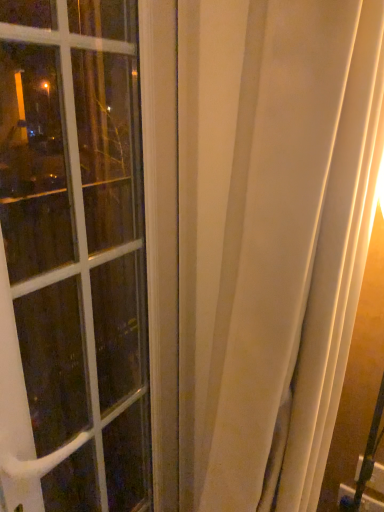
Question: Is white sheer curtain at center positioned behind white glass window at left?

Choices:
 (A) no
 (B) yes

Answer: (A)

Question: Can you confirm if white sheer curtain at center is shorter than white glass window at left?

Choices:
 (A) no
 (B) yes

Answer: (A)

Question: Are white sheer curtain at center and white glass window at left located far from each other?

Choices:
 (A) no
 (B) yes

Answer: (A)

Question: Is white sheer curtain at center beside white glass window at left?

Choices:
 (A) yes
 (B) no

Answer: (B)

Question: From a real-world perspective, is white sheer curtain at center physically above white glass window at left?

Choices:
 (A) yes
 (B) no

Answer: (B)

Question: Is white sheer curtain at center surrounding white glass window at left?

Choices:
 (A) yes
 (B) no

Answer: (B)

Question: Is white glass window at left positioned behind white sheer curtain at center?

Choices:
 (A) no
 (B) yes

Answer: (B)

Question: Can you confirm if white glass window at left is bigger than white sheer curtain at center?

Choices:
 (A) no
 (B) yes

Answer: (A)

Question: Is white glass window at left positioned before white sheer curtain at center?

Choices:
 (A) no
 (B) yes

Answer: (A)

Question: Is white glass window at left located outside white sheer curtain at center?

Choices:
 (A) no
 (B) yes

Answer: (B)

Question: Does white glass window at left have a lesser height compared to white sheer curtain at center?

Choices:
 (A) no
 (B) yes

Answer: (B)

Question: Can you confirm if white glass window at left is thinner than white sheer curtain at center?

Choices:
 (A) no
 (B) yes

Answer: (B)

Question: In terms of height, does white glass window at left look taller or shorter compared to white sheer curtain at center?

Choices:
 (A) short
 (B) tall

Answer: (A)